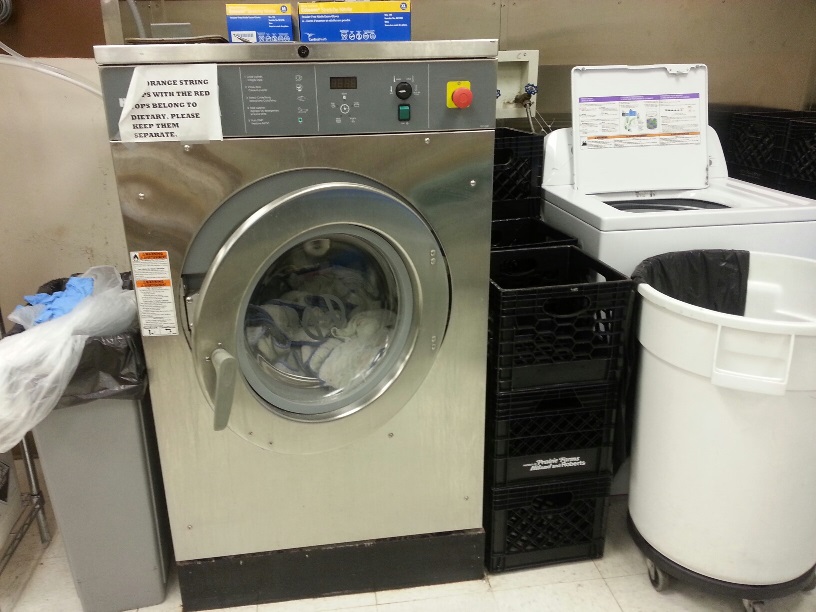
Find the location of `laundry`. laundry is located at coordinates (313, 315).